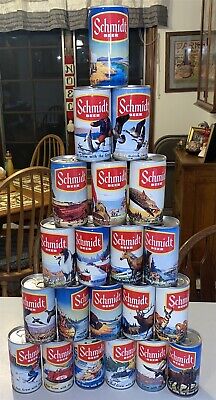
Find the location of a particular element. This screenshot has height=400, width=216. glass wooden case is located at coordinates (211, 95).